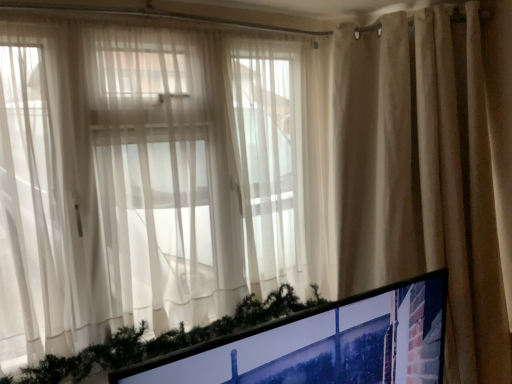
Question: Do you think beige fabric curtain at upper right is within matte black monitor at lower right, or outside of it?

Choices:
 (A) outside
 (B) inside

Answer: (A)

Question: In terms of width, does beige fabric curtain at upper right look wider or thinner when compared to matte black monitor at lower right?

Choices:
 (A) wide
 (B) thin

Answer: (A)

Question: Considering their positions, is beige fabric curtain at upper right located in front of or behind matte black monitor at lower right?

Choices:
 (A) front
 (B) behind

Answer: (B)

Question: In the image, is matte black monitor at lower right positioned in front of or behind beige fabric curtain at upper right?

Choices:
 (A) front
 (B) behind

Answer: (A)

Question: Considering the positions of point (245, 345) and point (413, 180), is point (245, 345) closer or farther from the camera than point (413, 180)?

Choices:
 (A) farther
 (B) closer

Answer: (B)

Question: Considering the positions of matte black monitor at lower right and beige fabric curtain at upper right in the image, is matte black monitor at lower right taller or shorter than beige fabric curtain at upper right?

Choices:
 (A) short
 (B) tall

Answer: (A)

Question: Considering the positions of matte black monitor at lower right and beige fabric curtain at upper right in the image, is matte black monitor at lower right wider or thinner than beige fabric curtain at upper right?

Choices:
 (A) wide
 (B) thin

Answer: (B)